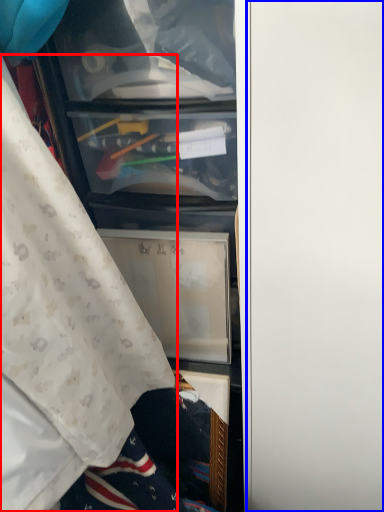
Question: Which object appears closest to the camera in this image, curtain (highlighted by a red box) or door (highlighted by a blue box)?

Choices:
 (A) curtain
 (B) door

Answer: (A)